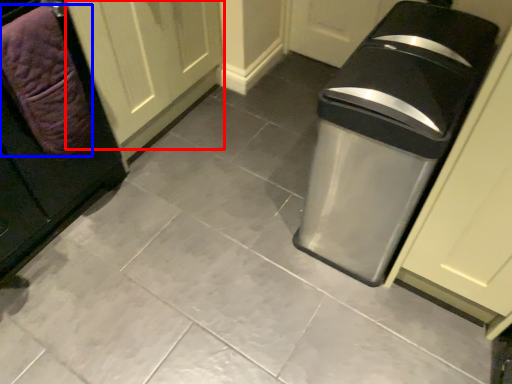
Question: Which of the following is the farthest to the observer, door (highlighted by a red box) or blanket (highlighted by a blue box)?

Choices:
 (A) door
 (B) blanket

Answer: (A)